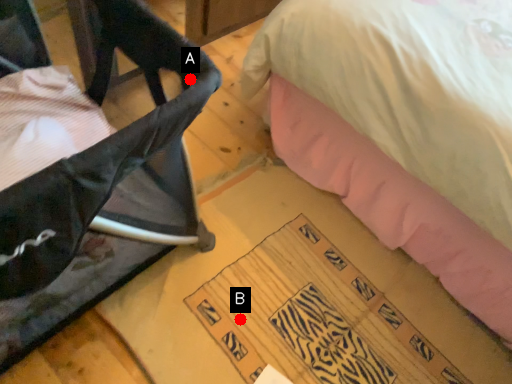
Question: Two points are circled on the image, labeled by A and B beside each circle. Which point is further to the camera?

Choices:
 (A) A is further
 (B) B is further

Answer: (B)